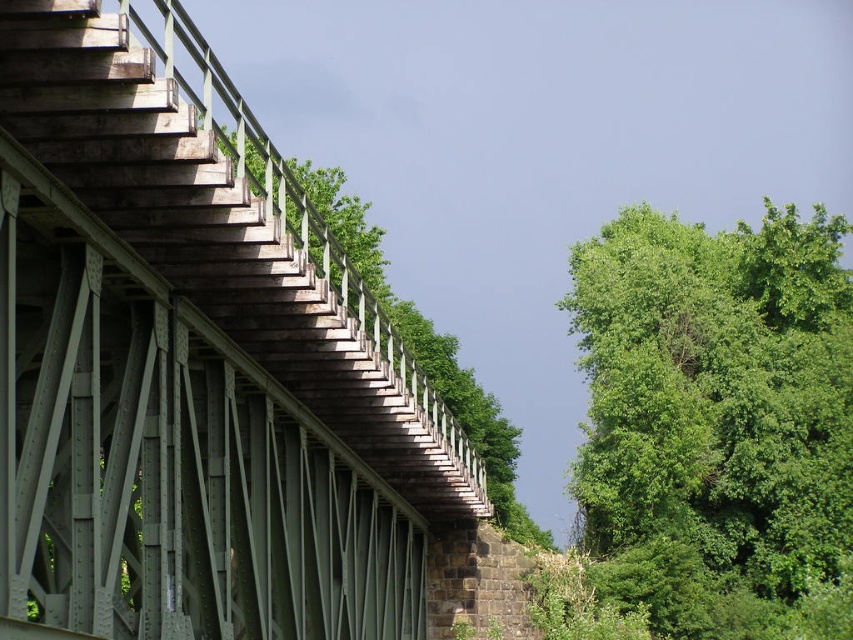
Is point (190, 278) more distant than point (637, 580)?

No, (190, 278) is closer to viewer.

Does green metallic bridge at left have a greater width compared to green leafy tree at right?

Incorrect, green metallic bridge at left's width does not surpass green leafy tree at right's.

You are a GUI agent. You are given a task and a screenshot of the screen. Output one action in this format:
    pyautogui.click(x=<x>, y=<y>)
    Task: Click on the green metallic bridge at left
    Image resolution: width=853 pixels, height=640 pixels.
    Given the screenshot: What is the action you would take?
    pyautogui.click(x=192, y=364)